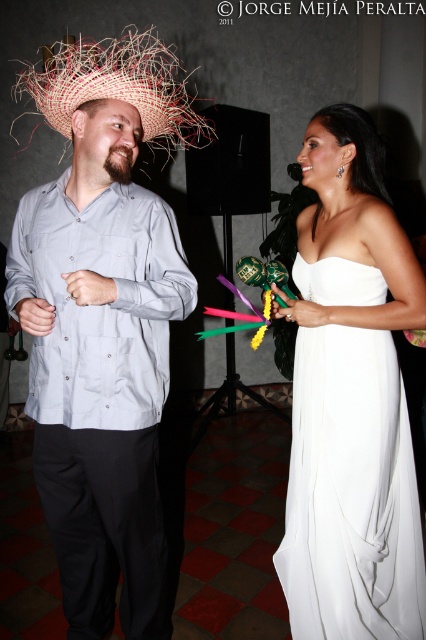
You are standing at the center of the room and want to move towards the white satin dress at right. In which direction should you move?

Since the white satin dress at right is located at point 0.770 on the x and 0.824 on the y, you should move towards the right and slightly forward to reach it.

You are a photographer setting up for a photo shoot. You need to position a spotlight so that it illuminates both the white satin dress at right and the straw hat at upper left. Considering their widths, which object requires a wider beam to cover its entire surface?

The straw hat at upper left requires a wider beam because it has a greater width than the white satin dress at right.